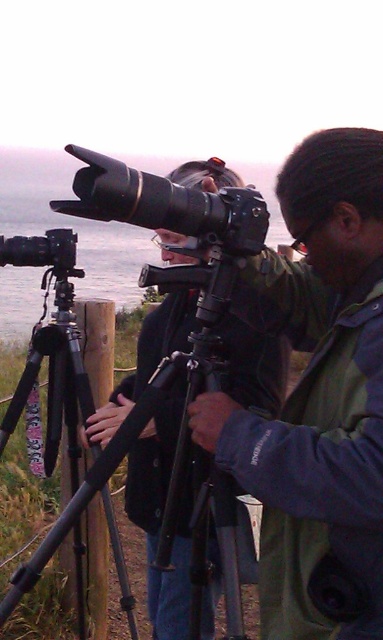
Where is `matte black camera at center`? The width and height of the screenshot is (383, 640). matte black camera at center is located at coordinates (165, 204).

Can you confirm if matte black camera at center is taller than matte black camera at left?

Yes, matte black camera at center is taller than matte black camera at left.

This screenshot has width=383, height=640. What are the coordinates of `matte black camera at center` in the screenshot? It's located at (165, 204).

You are a GUI agent. You are given a task and a screenshot of the screen. Output one action in this format:
    pyautogui.click(x=<x>, y=<y>)
    Task: Click on the matte black camera at center
    The height and width of the screenshot is (640, 383).
    Given the screenshot: What is the action you would take?
    pyautogui.click(x=165, y=204)

Does point (256, 214) lie in front of point (70, 436)?

Yes, point (256, 214) is in front of point (70, 436).

Who is taller, matte black camera at center or black matte tripod at left?

black matte tripod at left

I want to click on matte black camera at center, so click(x=165, y=204).

Who is more distant from viewer, (60, 310) or (80, 273)?

The point (60, 310) is more distant.

Consider the image. Is black matte tripod at left thinner than matte black camera at left?

No.

Locate an element on the screen. The height and width of the screenshot is (640, 383). black matte tripod at left is located at coordinates tap(57, 384).

The image size is (383, 640). Find the location of `black matte tripod at left`. black matte tripod at left is located at coordinates [x=57, y=384].